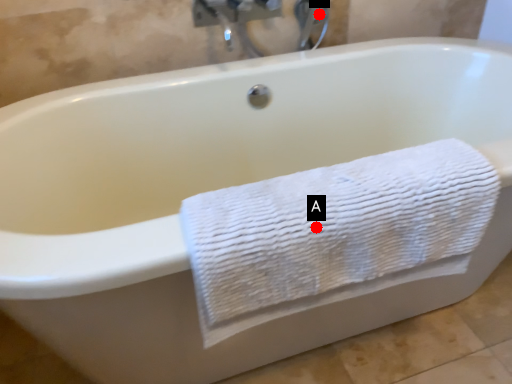
Question: Two points are circled on the image, labeled by A and B beside each circle. Which point appears closest to the camera in this image?

Choices:
 (A) A is closer
 (B) B is closer

Answer: (A)